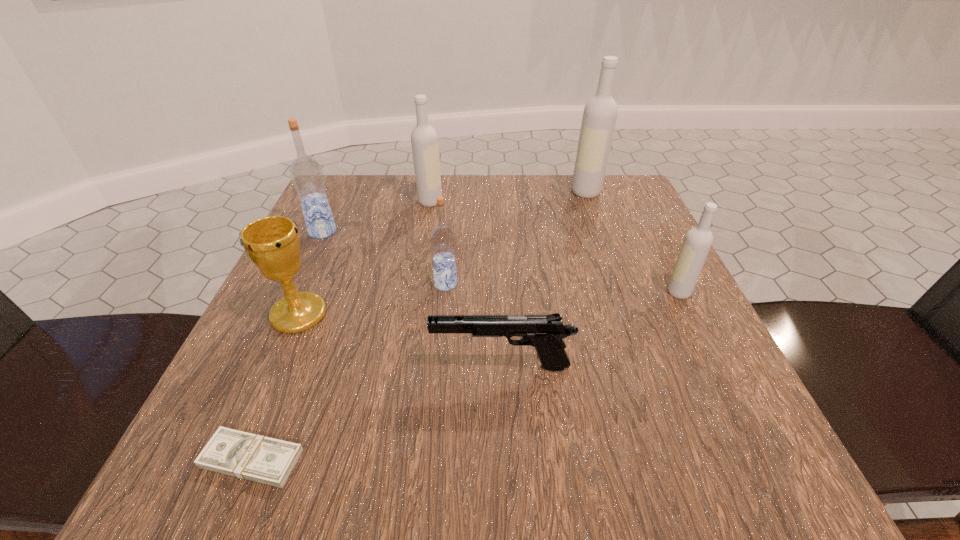
At what (x,y) coordinates should I click in order to perform the action: click on vodka that stands as the fourth closest to the second white vodka from left to right. Please return your answer as a coordinate pair (x, y). Looking at the image, I should click on (306, 173).

Identify which vodka is located as the second nearest to the right blue vodka. Please provide its 2D coordinates. Your answer should be formatted as a tuple, i.e. [(x, y)], where the tuple contains the x and y coordinates of a point satisfying the conditions above.

[(306, 173)]

Image resolution: width=960 pixels, height=540 pixels. I want to click on white vodka that is the second closest to the second biggest white vodka, so click(x=697, y=242).

Locate which white vodka ranks in proximity to the farther blue vodka. Please provide its 2D coordinates. Your answer should be formatted as a tuple, i.e. [(x, y)], where the tuple contains the x and y coordinates of a point satisfying the conditions above.

[(424, 140)]

Where is `free space that satisfies the following two spatial constraints: 1. on the front side of the third vodka from right to left; 2. on the left side of the leftmost white vodka`? The image size is (960, 540). free space that satisfies the following two spatial constraints: 1. on the front side of the third vodka from right to left; 2. on the left side of the leftmost white vodka is located at coordinates (417, 284).

At what (x,y) coordinates should I click in order to perform the action: click on vacant area that satisfies the following two spatial constraints: 1. on the front side of the third vodka from left to right; 2. on the right side of the farther blue vodka. Please return your answer as a coordinate pair (x, y). This screenshot has height=540, width=960. Looking at the image, I should click on coord(299,284).